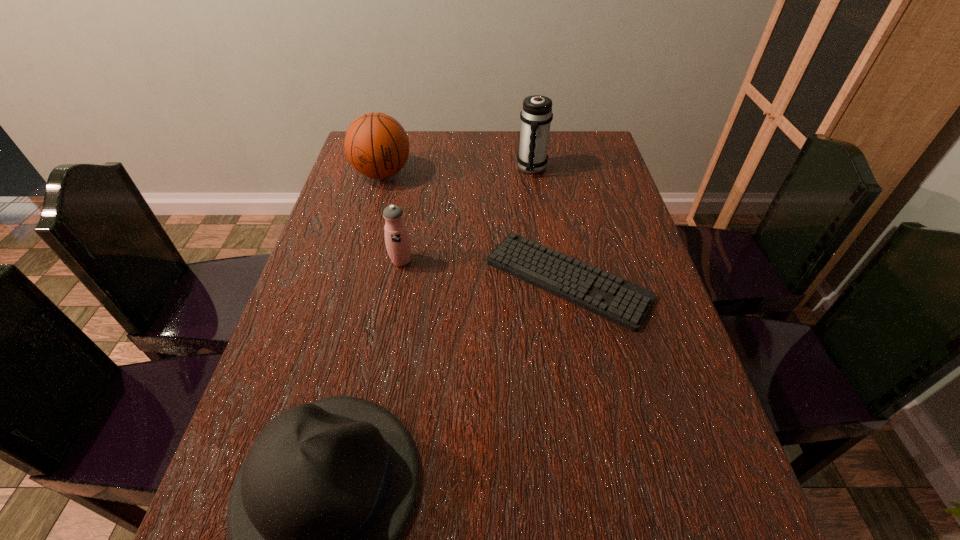
Image resolution: width=960 pixels, height=540 pixels. I want to click on the taller thermos bottle, so click(x=536, y=115).

The height and width of the screenshot is (540, 960). In order to click on the right thermos bottle in this screenshot , I will do tap(536, 115).

The height and width of the screenshot is (540, 960). I want to click on basketball, so [377, 146].

At what (x,y) coordinates should I click in order to perform the action: click on the nearer thermos bottle. Please return your answer as a coordinate pair (x, y). The image size is (960, 540). Looking at the image, I should click on (397, 240).

Locate an element on the screen. The image size is (960, 540). the shorter thermos bottle is located at coordinates (397, 240).

The image size is (960, 540). What are the coordinates of `computer keyboard` in the screenshot? It's located at (622, 302).

Find the location of `free region located 0.310m on the side with the handle of the farther thermos bottle`. free region located 0.310m on the side with the handle of the farther thermos bottle is located at coordinates (543, 247).

What are the coordinates of `vacant point located on the front of the basketball` in the screenshot? It's located at (351, 286).

At what (x,y) coordinates should I click in order to perform the action: click on free space located on the back of the left thermos bottle. Please return your answer as a coordinate pair (x, y). Image resolution: width=960 pixels, height=540 pixels. Looking at the image, I should click on (415, 183).

At what (x,y) coordinates should I click in order to perform the action: click on vacant space located 0.270m on the back of the computer keyboard. Please return your answer as a coordinate pair (x, y). This screenshot has height=540, width=960. Looking at the image, I should click on (548, 179).